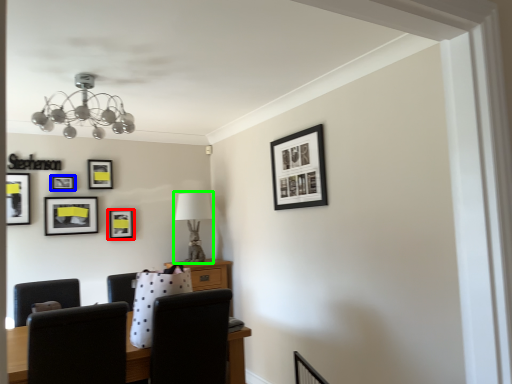
Question: Which object is positioned closest to picture frame (highlighted by a red box)? Select from picture frame (highlighted by a blue box) and table lamp (highlighted by a green box).

Choices:
 (A) picture frame
 (B) table lamp

Answer: (A)